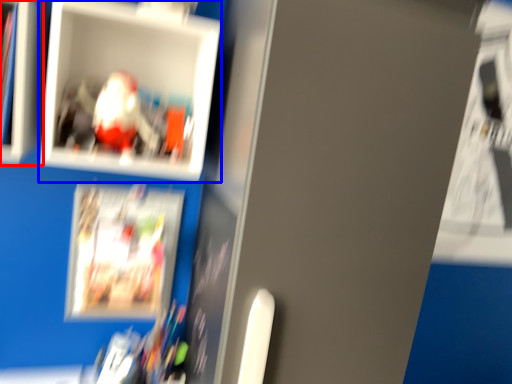
Question: Which object is closer to the camera taking this photo, cabinet (highlighted by a red box) or picture frame (highlighted by a blue box)?

Choices:
 (A) cabinet
 (B) picture frame

Answer: (A)